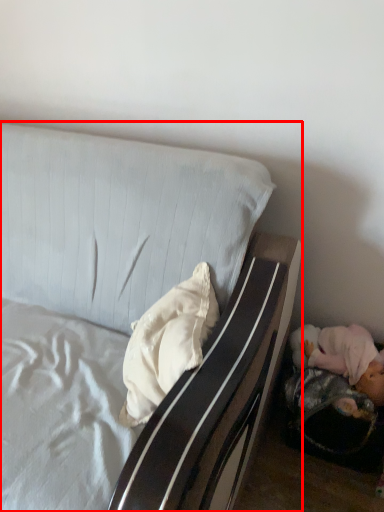
Question: From the image's perspective, considering the relative positions of bed (annotated by the red box) and pillow in the image provided, where is bed (annotated by the red box) located with respect to the staircase?

Choices:
 (A) below
 (B) above

Answer: (B)